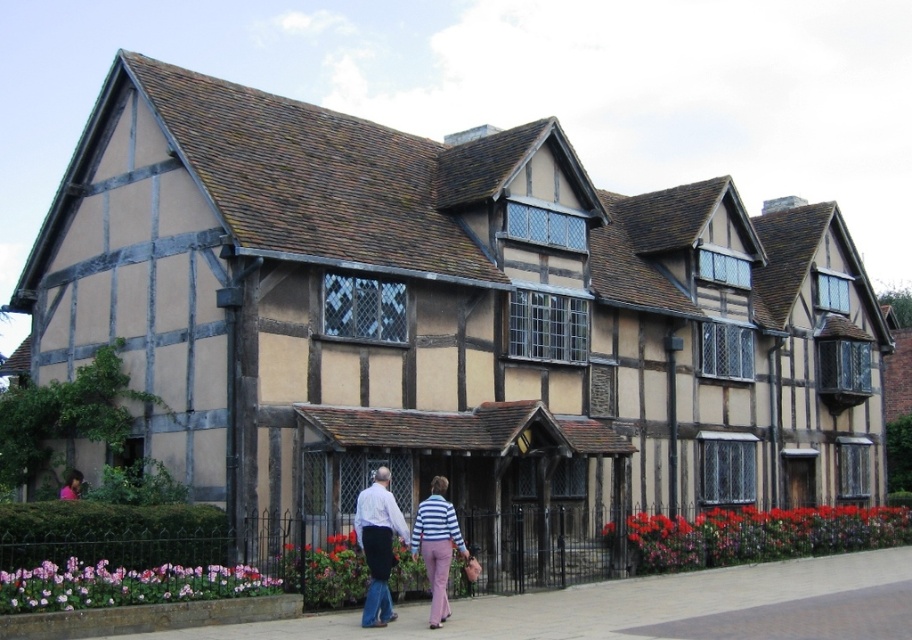
Is striped cotton sweater at center thinner than light blue shirt at center?

Indeed, striped cotton sweater at center has a lesser width compared to light blue shirt at center.

Is point (381, 577) positioned before point (384, 552)?

Yes.

Find the location of `striped cotton sweater at center`. striped cotton sweater at center is located at coordinates (405, 541).

Between light blue shirt at center and striped fabric pants at center, which one has more height?

Standing taller between the two is light blue shirt at center.

The height and width of the screenshot is (640, 912). What do you see at coordinates (378, 545) in the screenshot?
I see `light blue shirt at center` at bounding box center [378, 545].

Which is in front, point (377, 538) or point (427, 568)?

Positioned in front is point (377, 538).

At what (x,y) coordinates should I click in order to perform the action: click on light blue shirt at center. Please return your answer as a coordinate pair (x, y). The image size is (912, 640). Looking at the image, I should click on (378, 545).

Who is positioned more to the left, striped cotton sweater at center or striped fabric pants at center?

From the viewer's perspective, striped cotton sweater at center appears more on the left side.

Is point (417, 548) farther from camera compared to point (444, 499)?

No, (417, 548) is in front of (444, 499).

Between point (427, 529) and point (434, 616), which one is positioned in front?

Positioned in front is point (434, 616).

Find the location of `striped cotton sweater at center`. striped cotton sweater at center is located at coordinates (405, 541).